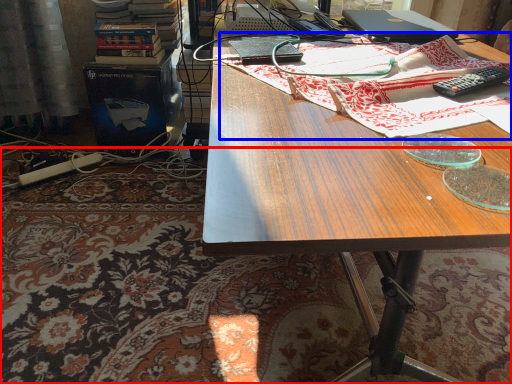
Question: Among these objects, which one is nearest to the camera, mat (highlighted by a red box) or cloth (highlighted by a blue box)?

Choices:
 (A) mat
 (B) cloth

Answer: (B)